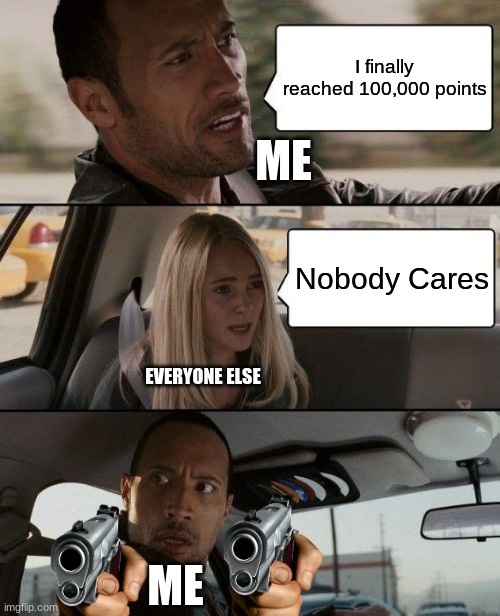
You are a GUI agent. You are given a task and a screenshot of the screen. Output one action in this format:
    pyautogui.click(x=<x>, y=<y>)
    Task: Click on the cd's
    Image resolution: width=500 pixels, height=616 pixels.
    Given the screenshot: What is the action you would take?
    pyautogui.click(x=314, y=492), pyautogui.click(x=344, y=482), pyautogui.click(x=295, y=488), pyautogui.click(x=282, y=491)